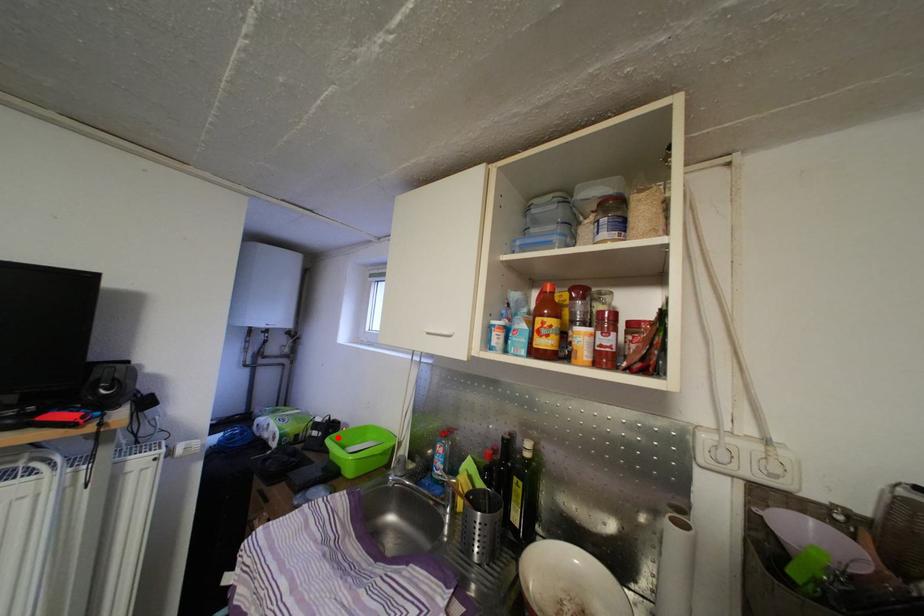
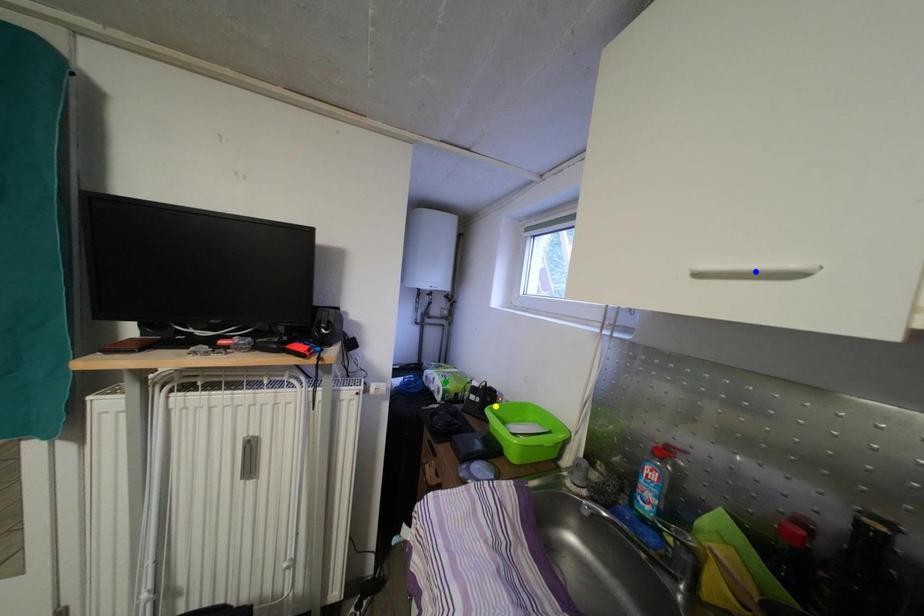
Question: I am providing you with two images of the same scene from different viewpoints. A red point is marked on the first image. You are given multiple points on the second image. In image 2, which mark is for the same physical point as the one in image 1?

Choices:
 (A) yellow point
 (B) blue point
 (C) green point

Answer: (A)